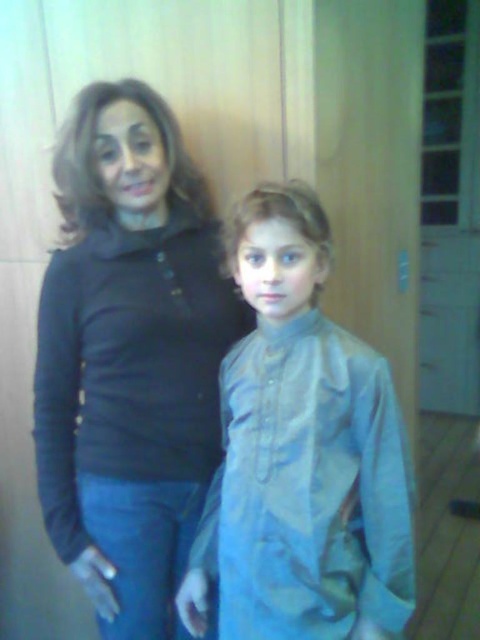
Based on the photo, you are a tailor measuring the distance between two garments. The matte black turtleneck at upper left and the light blue fabric shirt at center are hanging on a rack. Can you fit a third garment between them if it requires 10 inches of space?

The matte black turtleneck at upper left is 10.51 inches away from the light blue fabric shirt at center. Since the required space is 10 inches, which is less than the available distance, yes, the third garment can fit between them.

You are a tailor measuring clothes for two customers. The first customer is wearing a matte black turtleneck at upper left, and the second is wearing a light blue fabric shirt at center. Which customer might need a larger garment size based on the clothing they are wearing?

The matte black turtleneck at upper left is larger in size than the light blue fabric shirt at center, so the first customer wearing the matte black turtleneck at upper left likely needs a larger garment size.